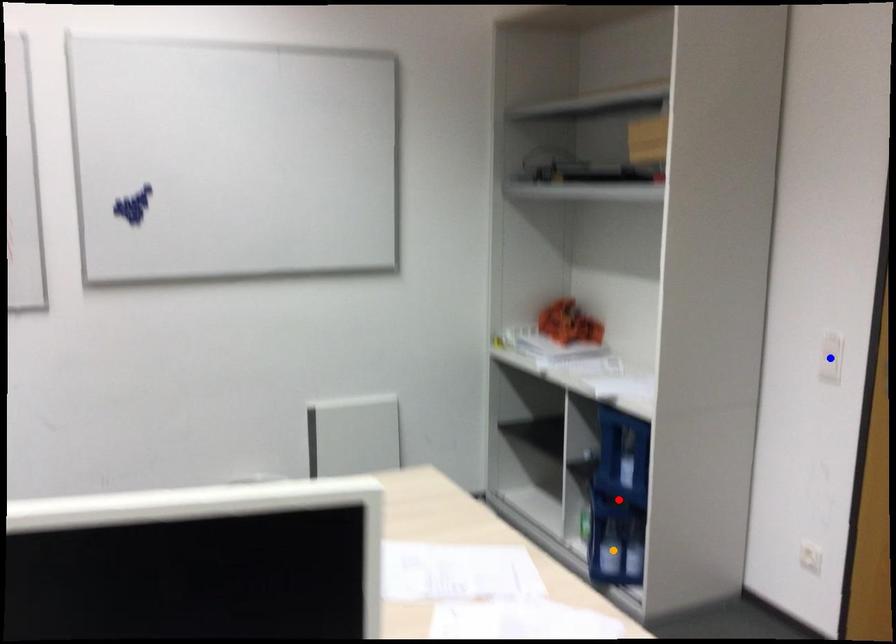
In the scene shown: Order these from nearest to farthest:
orange point | blue point | red point

blue point
red point
orange point